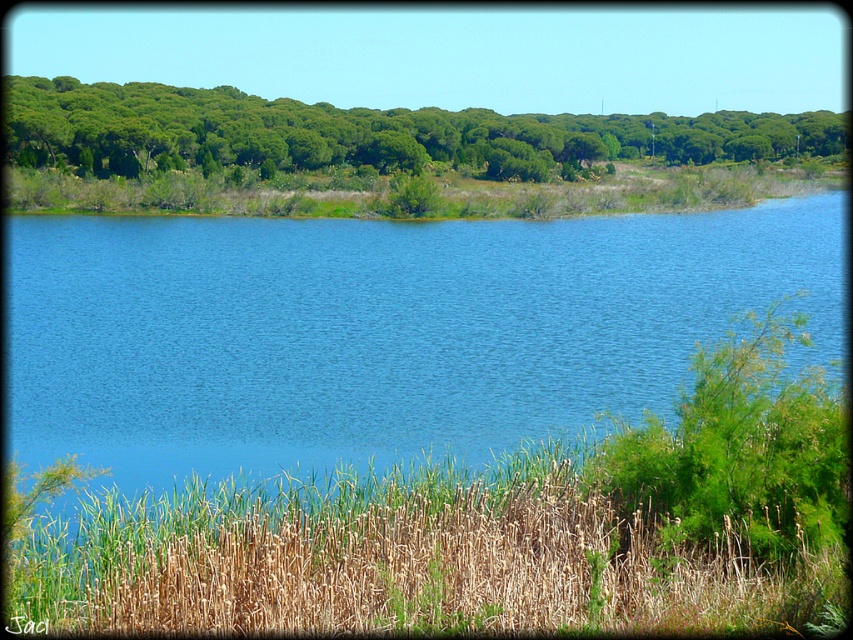
Based on the photo, which of these two, blue water at center or green leafy trees at upper center, stands shorter?

blue water at center is shorter.

Between point (500, 356) and point (810, 134), which one is positioned in front?

Point (500, 356) is in front.

The width and height of the screenshot is (853, 640). Identify the location of blue water at center. (381, 330).

In the scene shown: Can you confirm if blue water at center is smaller than green dry grass at lower center?

A: Incorrect, blue water at center is not smaller in size than green dry grass at lower center.

Does blue water at center have a greater width compared to green dry grass at lower center?

Yes.

What do you see at coordinates (381, 330) in the screenshot? The image size is (853, 640). I see `blue water at center` at bounding box center [381, 330].

Where is `blue water at center`? The image size is (853, 640). blue water at center is located at coordinates (381, 330).

Between green dry grass at lower center and green leafy trees at upper center, which one is positioned lower?

green dry grass at lower center

Who is taller, green dry grass at lower center or green leafy trees at upper center?

green leafy trees at upper center is taller.

The image size is (853, 640). What are the coordinates of `green dry grass at lower center` in the screenshot? It's located at (412, 561).